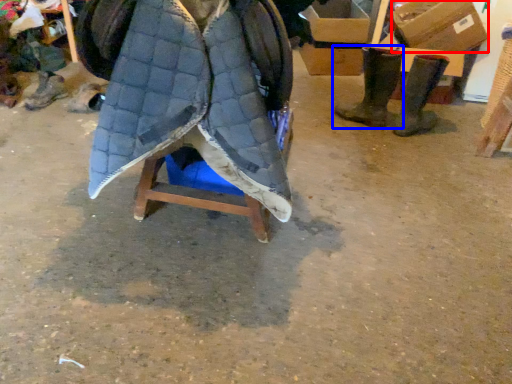
Question: Which point is closer to the camera, cardboard box (highlighted by a red box) or footwear (highlighted by a blue box)?

Choices:
 (A) cardboard box
 (B) footwear

Answer: (B)